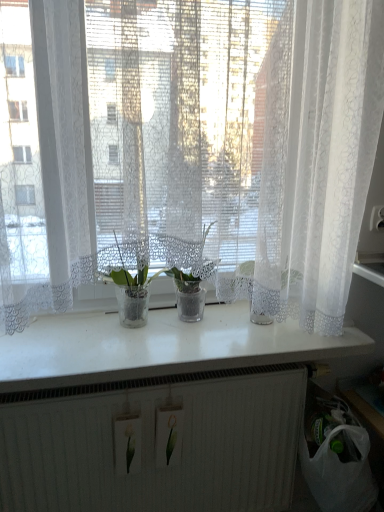
Find the location of a particular element. vacant location below translucent glass pot at center, marked as the second houseplant in a left-to-right arrangement (from a real-world perspective) is located at coordinates (193, 320).